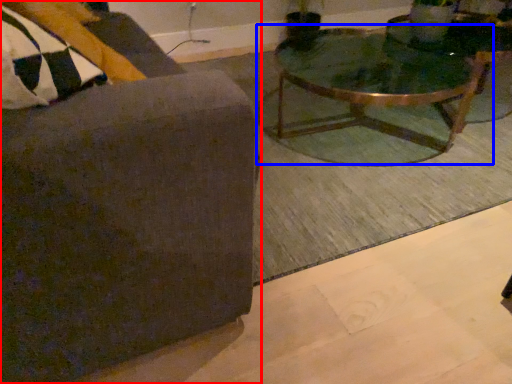
Question: Which point is closer to the camera, chair (highlighted by a red box) or coffee table (highlighted by a blue box)?

Choices:
 (A) chair
 (B) coffee table

Answer: (A)